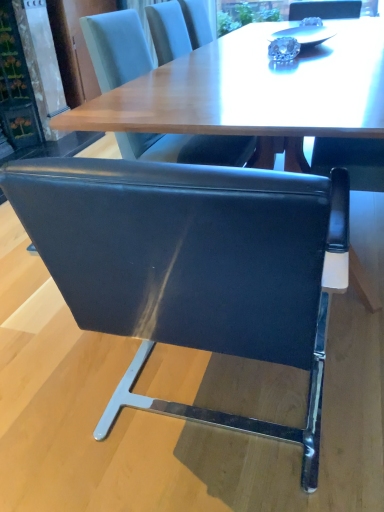
Question: Is black leather chair at center, the 2th chair in the right-to-left sequence, further to camera compared to black leather chair at upper center, which ranks as the first chair in right-to-left order?

Choices:
 (A) yes
 (B) no

Answer: (B)

Question: From a real-world perspective, is black leather chair at center, which is the 1th chair from left to right, positioned over black leather chair at upper center, which ranks as the first chair in right-to-left order, based on gravity?

Choices:
 (A) yes
 (B) no

Answer: (B)

Question: Can black leather chair at upper center, which ranks as the first chair in right-to-left order, be found inside black leather chair at center, which is the 1th chair from left to right?

Choices:
 (A) yes
 (B) no

Answer: (B)

Question: Is black leather chair at center, the 2th chair in the right-to-left sequence, next to black leather chair at upper center, which ranks as the first chair in right-to-left order, and touching it?

Choices:
 (A) no
 (B) yes

Answer: (A)

Question: From a real-world perspective, does black leather chair at center, the 2th chair in the right-to-left sequence, sit lower than black leather chair at upper center, arranged as the second chair when viewed from the left?

Choices:
 (A) yes
 (B) no

Answer: (A)

Question: Is black leather chair at center, which is the 1th chair from left to right, outside black leather chair at upper center, which ranks as the first chair in right-to-left order?

Choices:
 (A) yes
 (B) no

Answer: (A)

Question: Considering the relative sizes of black leather chair at upper center, arranged as the second chair when viewed from the left, and black leather chair at center, which is the 1th chair from left to right, in the image provided, is black leather chair at upper center, arranged as the second chair when viewed from the left, taller than black leather chair at center, which is the 1th chair from left to right,?

Choices:
 (A) no
 (B) yes

Answer: (B)

Question: Can you see black leather chair at upper center, which ranks as the first chair in right-to-left order, touching black leather chair at center, which is the 1th chair from left to right?

Choices:
 (A) yes
 (B) no

Answer: (B)

Question: Is black leather chair at upper center, arranged as the second chair when viewed from the left, bigger than black leather chair at center, which is the 1th chair from left to right?

Choices:
 (A) yes
 (B) no

Answer: (B)

Question: Is black leather chair at center, the 2th chair in the right-to-left sequence, at the back of black leather chair at upper center, which ranks as the first chair in right-to-left order?

Choices:
 (A) yes
 (B) no

Answer: (B)

Question: Can you confirm if black leather chair at upper center, which ranks as the first chair in right-to-left order, is positioned to the right of black leather chair at center, which is the 1th chair from left to right?

Choices:
 (A) no
 (B) yes

Answer: (B)

Question: From a real-world perspective, does black leather chair at upper center, which ranks as the first chair in right-to-left order, sit lower than black leather chair at center, the 2th chair in the right-to-left sequence?

Choices:
 (A) no
 (B) yes

Answer: (A)

Question: Is black leather chair at center, the 2th chair in the right-to-left sequence, wider or thinner than black leather chair at upper center, arranged as the second chair when viewed from the left?

Choices:
 (A) wide
 (B) thin

Answer: (A)